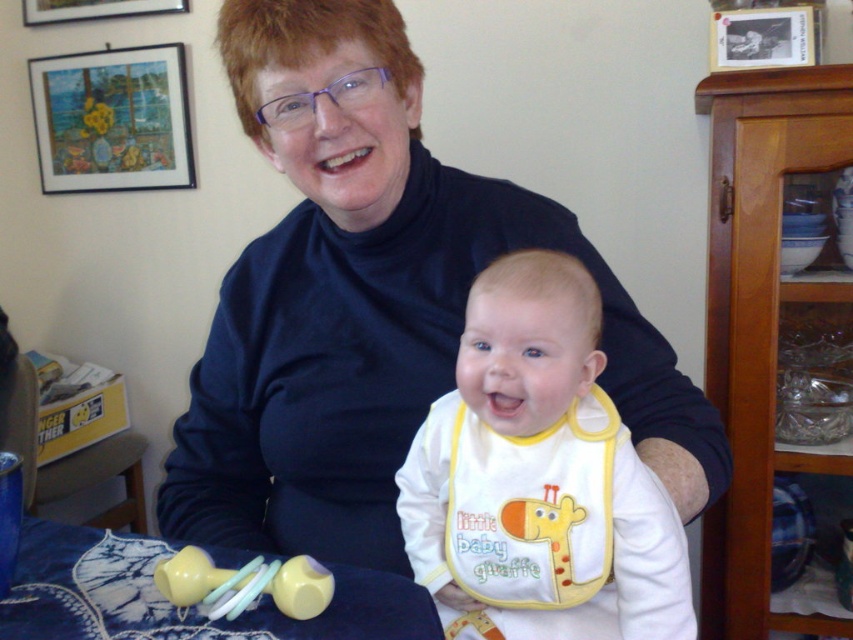
Is white soft bib at center above wooden picture frame at upper left?

No.

Between point (584, 589) and point (24, 17), which one is positioned behind?

The point (24, 17) is behind.

The image size is (853, 640). I want to click on white soft bib at center, so click(538, 477).

What are the coordinates of `white soft bib at center` in the screenshot? It's located at (538, 477).

Can you confirm if matte black sweater at center is thinner than wooden picture frame at upper left?

In fact, matte black sweater at center might be wider than wooden picture frame at upper left.

Find the location of `matte black sweater at center`. matte black sweater at center is located at coordinates (372, 305).

Is white soft bib at center shorter than metallic silver photo frame at upper right?

Incorrect, white soft bib at center's height does not fall short of metallic silver photo frame at upper right's.

Based on the photo, who is more forward, (x=525, y=516) or (x=799, y=49)?

Positioned in front is point (x=525, y=516).

This screenshot has height=640, width=853. Find the location of `white soft bib at center`. white soft bib at center is located at coordinates (538, 477).